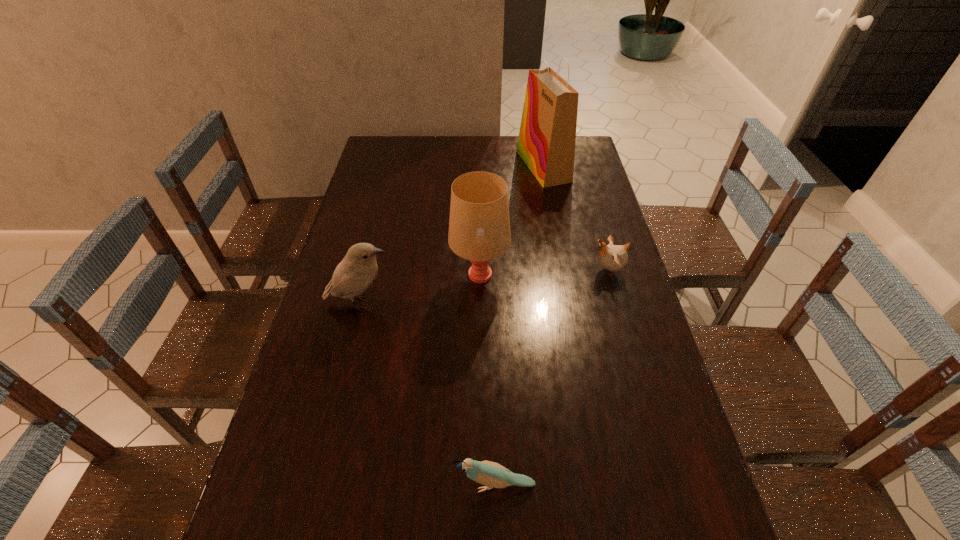
Where is `free region located 0.310m at the beak of the second nearest bird`? free region located 0.310m at the beak of the second nearest bird is located at coordinates (503, 303).

At what (x,y) coordinates should I click in order to perform the action: click on vacant position located at the beak of the rightmost bird. Please return your answer as a coordinate pair (x, y). The height and width of the screenshot is (540, 960). Looking at the image, I should click on (472, 270).

This screenshot has height=540, width=960. Identify the location of vacant space situated at the beak of the rightmost bird. tap(521, 270).

Locate an element on the screen. This screenshot has height=540, width=960. blank space located 0.320m at the beak of the rightmost bird is located at coordinates (486, 270).

Where is `free space located at the face of the nearest bird`? free space located at the face of the nearest bird is located at coordinates (310, 485).

Locate an element on the screen. vacant space situated 0.260m at the face of the nearest bird is located at coordinates (329, 485).

At what (x,y) coordinates should I click in order to perform the action: click on vacant space situated at the face of the nearest bird. Please return your answer as a coordinate pair (x, y). The height and width of the screenshot is (540, 960). Looking at the image, I should click on (339, 485).

I want to click on object that is at the far edge, so click(x=546, y=143).

Find the location of a particular element. This screenshot has width=960, height=540. object that is at the left edge is located at coordinates (355, 273).

The height and width of the screenshot is (540, 960). What are the coordinates of `shopping bag at the right edge` in the screenshot? It's located at (546, 143).